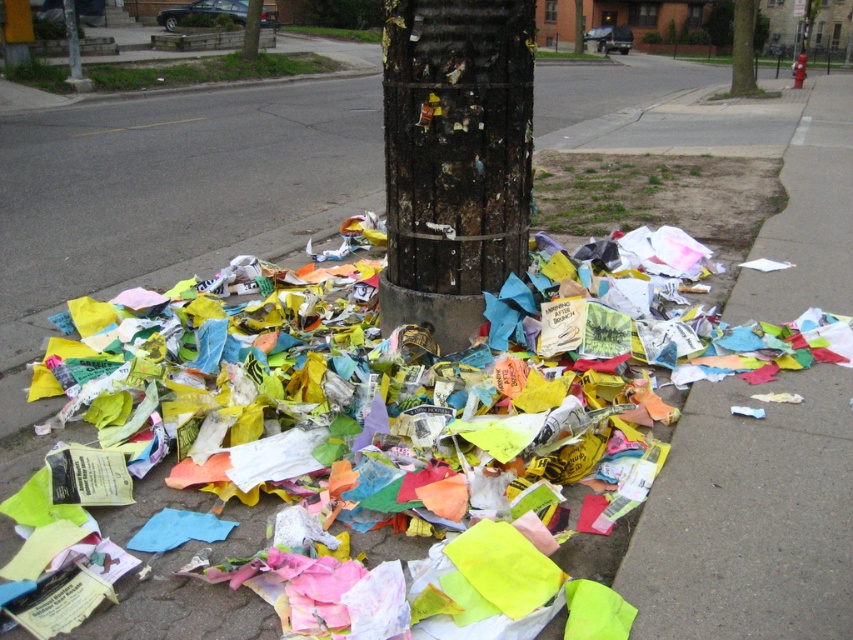
Does paper at lower right have a smaller size compared to charred wood post at center?

Incorrect, paper at lower right is not smaller in size than charred wood post at center.

Is point (808, 131) positioned behind point (401, 212)?

Yes.

Identify the location of paper at lower right. Image resolution: width=853 pixels, height=640 pixels. (749, 516).

You are a GUI agent. You are given a task and a screenshot of the screen. Output one action in this format:
    pyautogui.click(x=<x>, y=<y>)
    Task: Click on the paper at lower right
    
    Given the screenshot: What is the action you would take?
    pyautogui.click(x=749, y=516)

Can you confirm if multicolored paper at center is thinner than charred wood post at center?

In fact, multicolored paper at center might be wider than charred wood post at center.

Between multicolored paper at center and charred wood post at center, which one has more height?

charred wood post at center is taller.

Locate an element on the screen. This screenshot has width=853, height=640. multicolored paper at center is located at coordinates (270, 403).

Identify the location of multicolored paper at center. (270, 403).

Is multicolored paper at center bigger than paper at lower right?

Incorrect, multicolored paper at center is not larger than paper at lower right.

This screenshot has height=640, width=853. I want to click on multicolored paper at center, so click(x=270, y=403).

Is point (306, 472) farther from viewer compared to point (732, 516)?

Yes, point (306, 472) is farther from viewer.

In order to click on multicolored paper at center in this screenshot , I will do `click(270, 403)`.